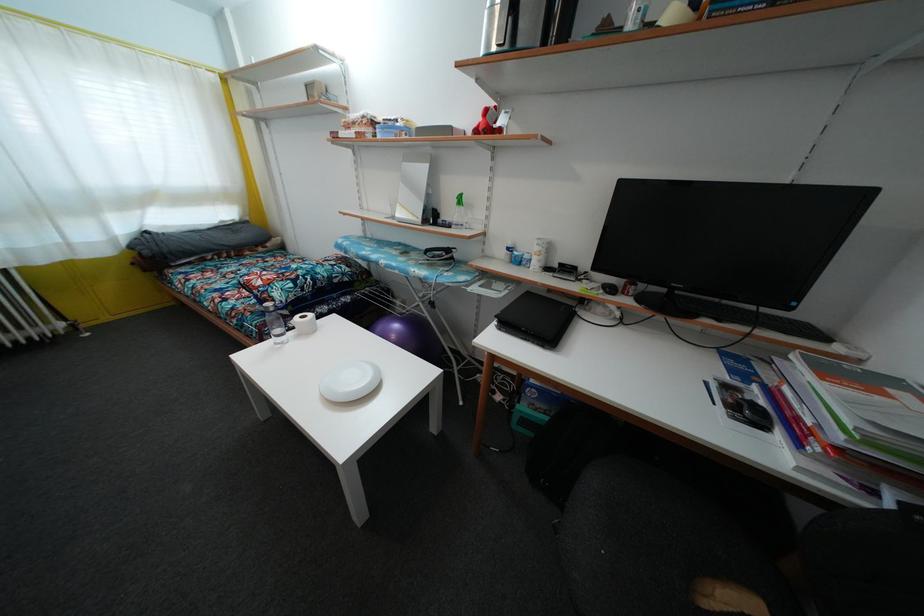
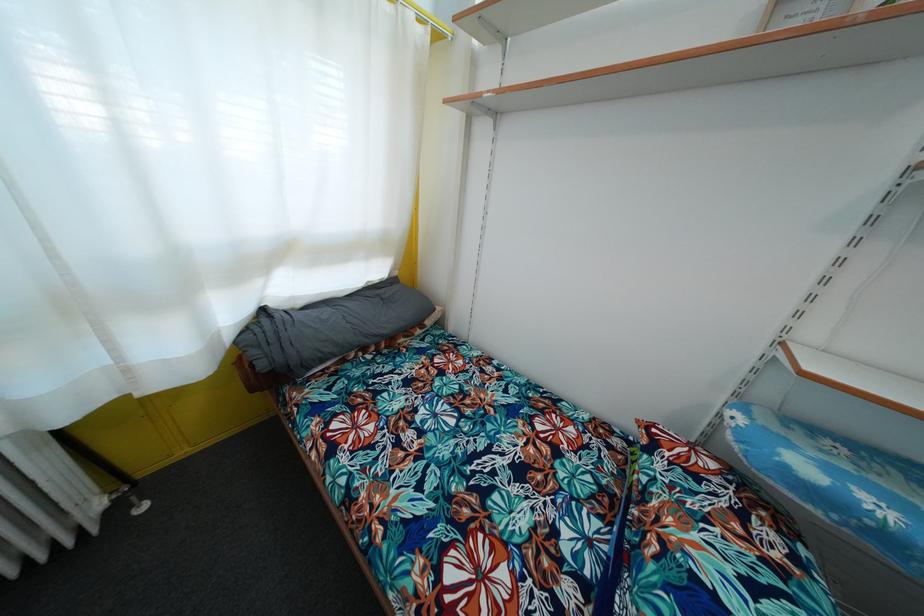
From the picture: What movement of the cameraman would produce the second image?

The cameraman walked toward left, forward.